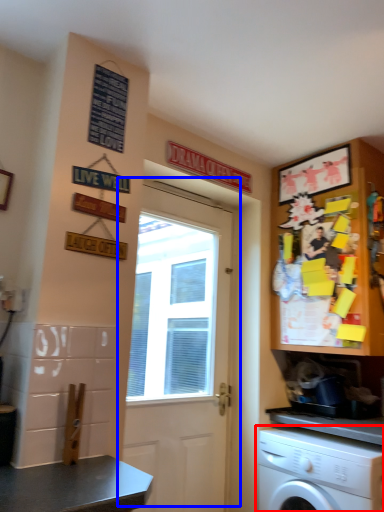
Question: Which object appears farthest to the camera in this image, washing machine (highlighted by a red box) or door (highlighted by a blue box)?

Choices:
 (A) washing machine
 (B) door

Answer: (B)